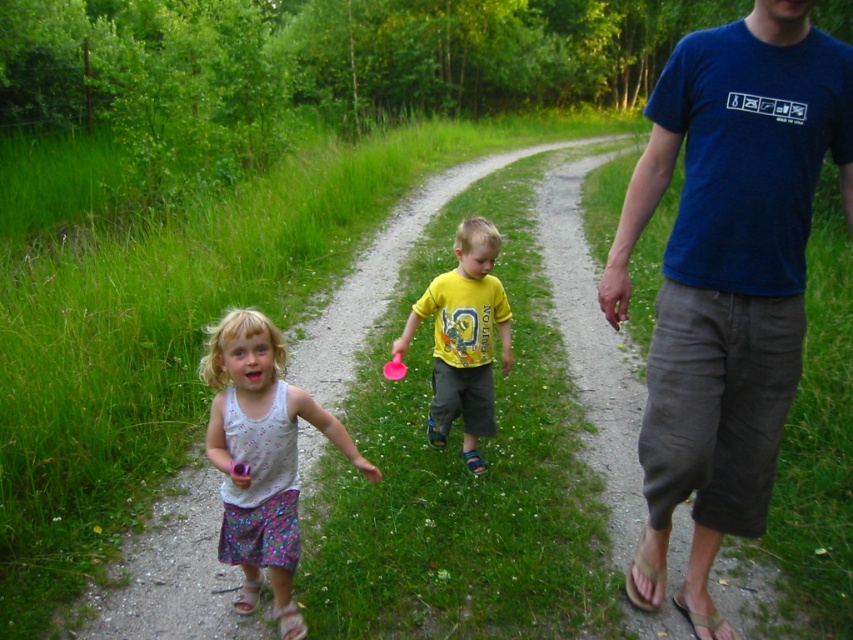
You are standing at the point with coordinates point (467, 280) and want to walk towards the point (258, 346). Which direction should you move?

You should move forward because point (258, 346) is closer to the viewer than point (467, 280).

You are a photographer trying to take a clear photo of the pink rubber ball at center without the yellow matte shirt at center blocking it. What should you do?

Move the camera forward so that the yellow matte shirt at center is no longer in front of the pink rubber ball at center.